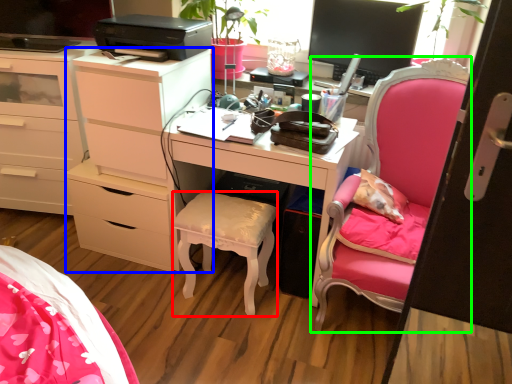
Question: Considering the real-world distances, which object is farthest from stool (highlighted by a red box)? chest of drawers (highlighted by a blue box) or chair (highlighted by a green box)?

Choices:
 (A) chest of drawers
 (B) chair

Answer: (B)